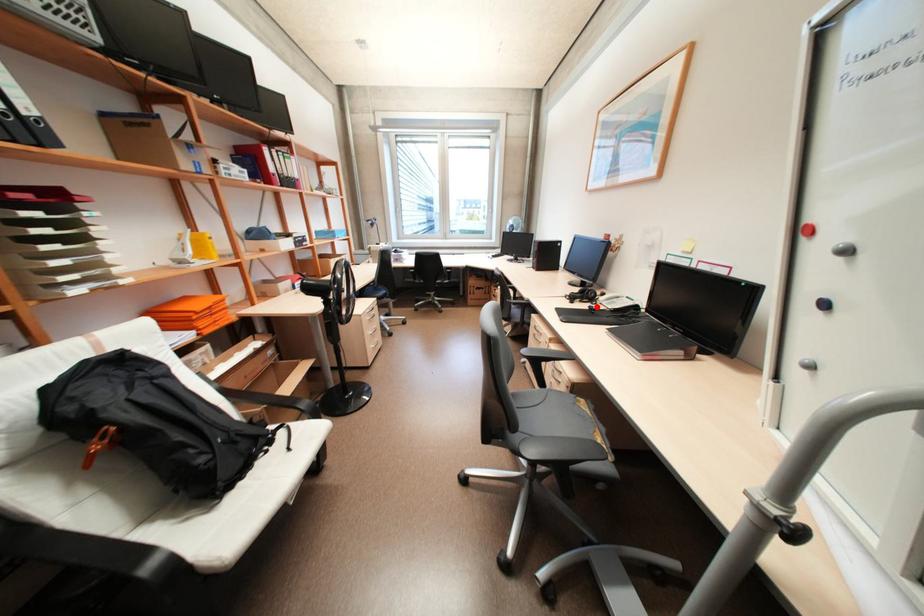
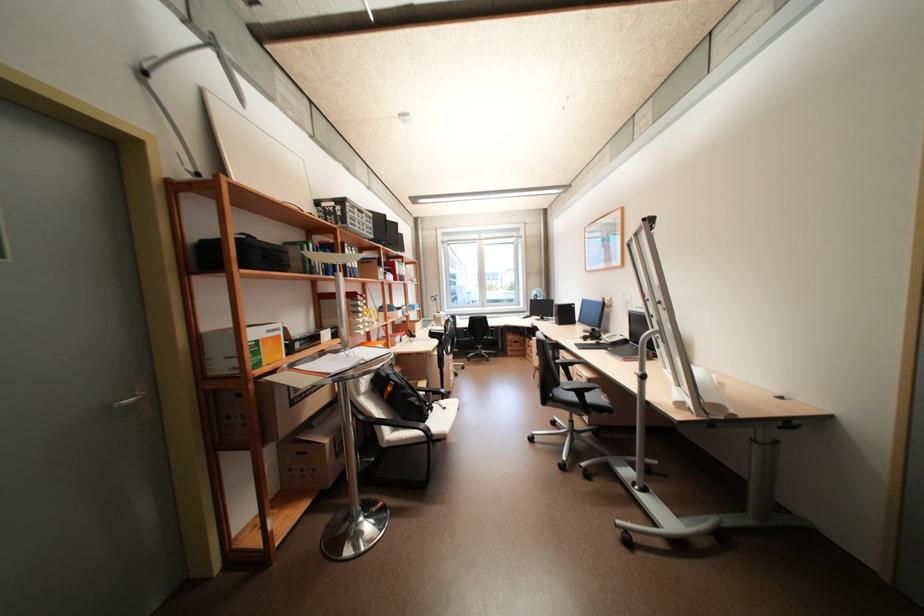
In the second image, find the point that corresponds to the highlighted location in the first image.

(603, 342)